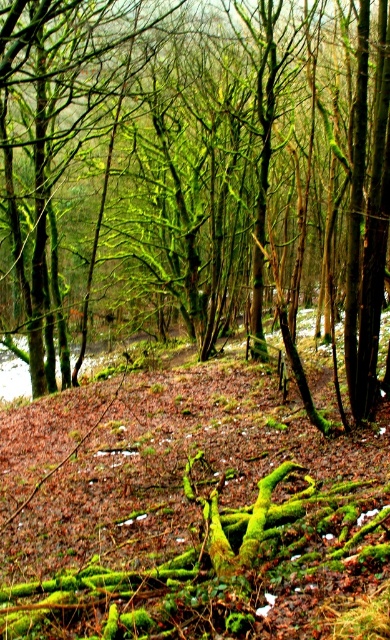
Is green mossy tree at center shorter than green mossy roots at lower center?

No, green mossy tree at center is not shorter than green mossy roots at lower center.

In order to click on green mossy tree at center in this screenshot , I will do `click(203, 173)`.

Where is `green mossy tree at center`? green mossy tree at center is located at coordinates (203, 173).